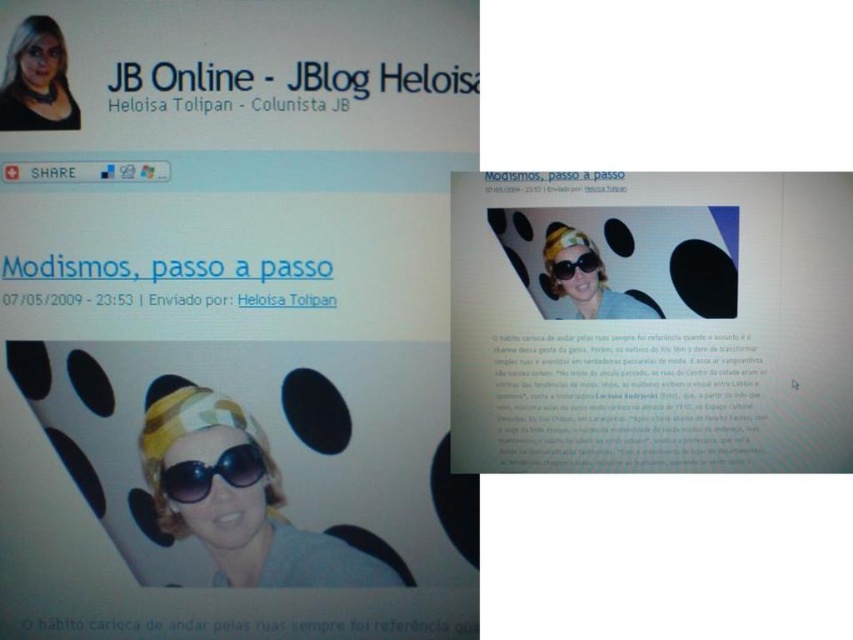
Does yellow fabric headband at center have a greater height compared to matte yellow goggles at center?

Yes.

Is yellow fabric headband at center smaller than matte yellow goggles at center?

No, yellow fabric headband at center is not smaller than matte yellow goggles at center.

Who is more forward, (241, 419) or (567, 260)?

Point (567, 260) is in front.

Where is `yellow fabric headband at center`? Image resolution: width=853 pixels, height=640 pixels. yellow fabric headband at center is located at coordinates (236, 499).

Is matte black hair at upper left below matte yellow goggles at center?

No, matte black hair at upper left is not below matte yellow goggles at center.

Which is above, matte black hair at upper left or matte yellow goggles at center?

matte black hair at upper left is above.

Where is `matte black hair at upper left`? This screenshot has width=853, height=640. matte black hair at upper left is located at coordinates point(36,80).

Which is below, matte black hair at upper left or matte yellow headband at center?

matte yellow headband at center is below.

In the scene shown: Can you confirm if matte black hair at upper left is bigger than matte yellow headband at center?

Yes.

Between point (47, 19) and point (607, 292), which one is positioned in front?

Positioned in front is point (47, 19).

Find the location of `matte black hair at upper left`. matte black hair at upper left is located at coordinates (36, 80).